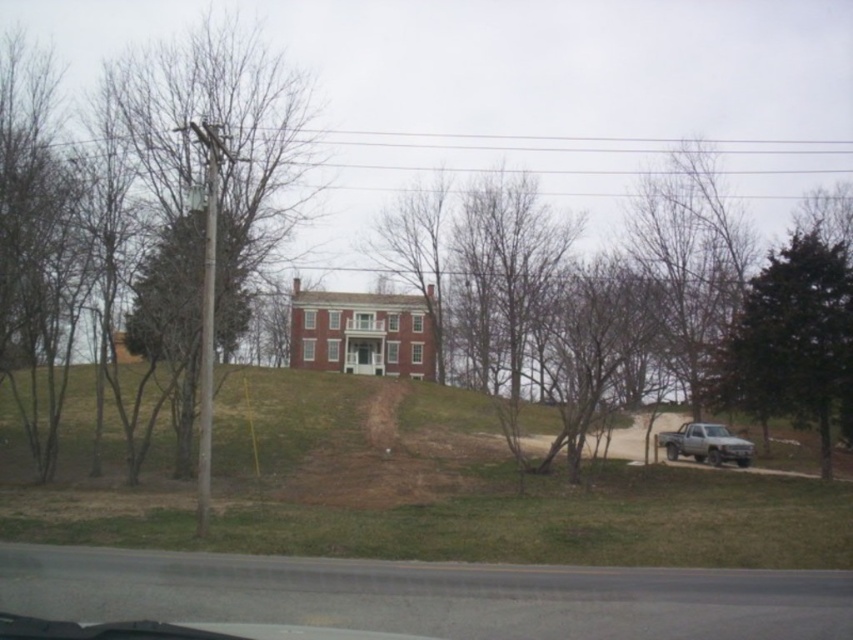
Does point (802, 285) come in front of point (726, 440)?

Yes.

Is green leafy tree at right above silver metallic truck at lower right?

A: Yes.

What do you see at coordinates (791, 339) in the screenshot?
I see `green leafy tree at right` at bounding box center [791, 339].

Identify the location of green leafy tree at right. (791, 339).

Who is positioned more to the left, bare branches at center or silver metallic truck at lower right?

silver metallic truck at lower right

Who is shorter, bare branches at center or silver metallic truck at lower right?

Standing shorter between the two is silver metallic truck at lower right.

Where is `bare branches at center`? This screenshot has width=853, height=640. bare branches at center is located at coordinates (654, 305).

Image resolution: width=853 pixels, height=640 pixels. I want to click on bare branches at center, so click(x=654, y=305).

Which is behind, point (341, 552) or point (811, 390)?

The point (811, 390) is behind.

Can you confirm if green grassy at lower center is bigger than green leafy tree at right?

Yes, green grassy at lower center is bigger than green leafy tree at right.

What do you see at coordinates (410, 486) in the screenshot?
I see `green grassy at lower center` at bounding box center [410, 486].

The height and width of the screenshot is (640, 853). In order to click on green grassy at lower center in this screenshot , I will do `click(410, 486)`.